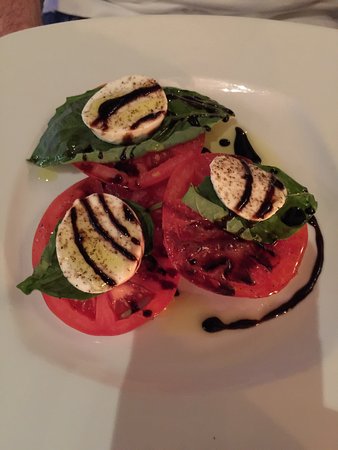
Image resolution: width=338 pixels, height=450 pixels. I want to click on napkin, so (110, 7).